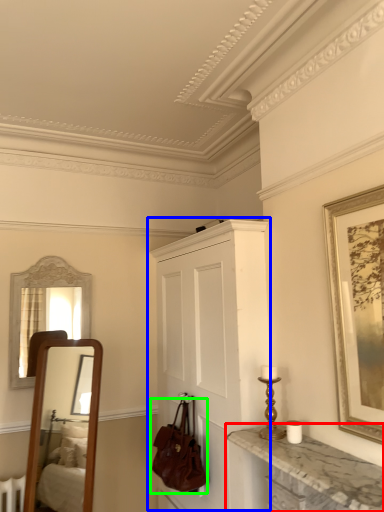
Question: Which is nearer to the countertop (highlighted by a red box)? cabinetry (highlighted by a blue box) or handbag (highlighted by a green box).

Choices:
 (A) cabinetry
 (B) handbag

Answer: (A)